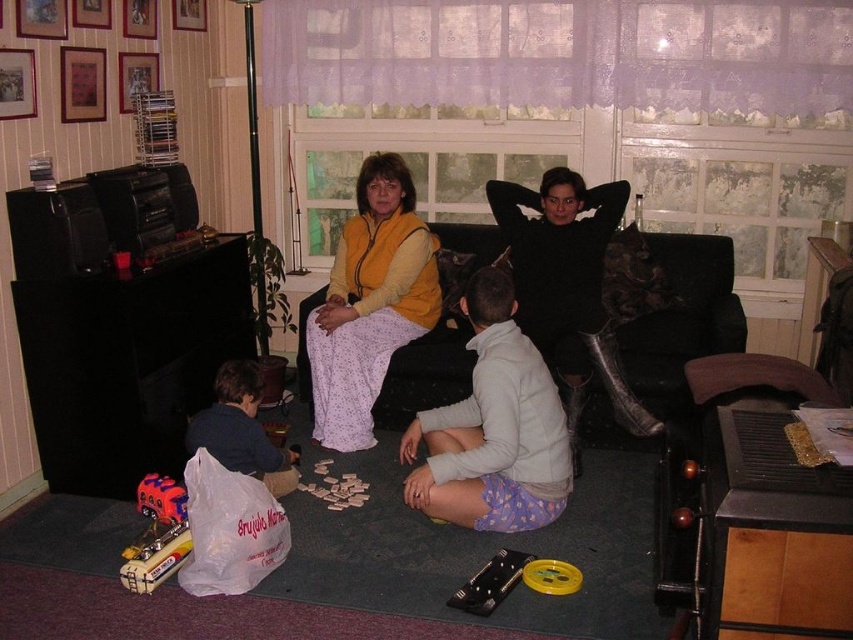
Is point (421, 508) less distant than point (144, 492)?

Yes, it is.

Between light gray fleece at center and shiny plastic toy car at lower left, which one has more height?

With more height is light gray fleece at center.

The height and width of the screenshot is (640, 853). What are the coordinates of `light gray fleece at center` in the screenshot? It's located at (492, 428).

Is black fabric couch at center above light gray fleece at center?

Correct, black fabric couch at center is located above light gray fleece at center.

Is black fabric couch at center positioned at the back of light gray fleece at center?

That is True.

Find the location of a particular element. Image resolution: width=853 pixels, height=640 pixels. black fabric couch at center is located at coordinates (663, 336).

Is point (326, 346) positioned in front of point (605, 385)?

No, it is not.

Can you confirm if matte yellow vest at center is thinner than black leather boots at center?

Correct, matte yellow vest at center's width is less than black leather boots at center's.

Describe the element at coordinates (370, 301) in the screenshot. I see `matte yellow vest at center` at that location.

I want to click on matte yellow vest at center, so click(370, 301).